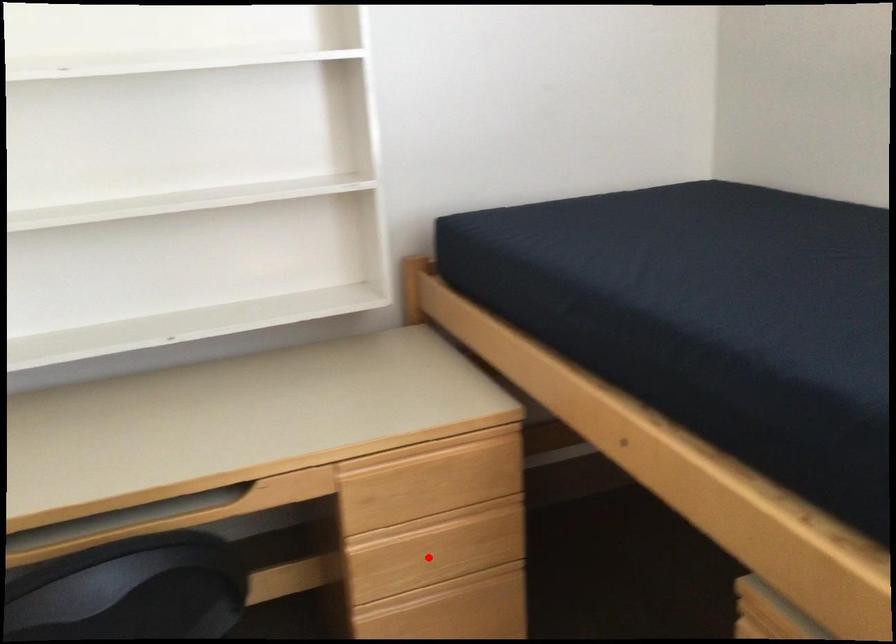
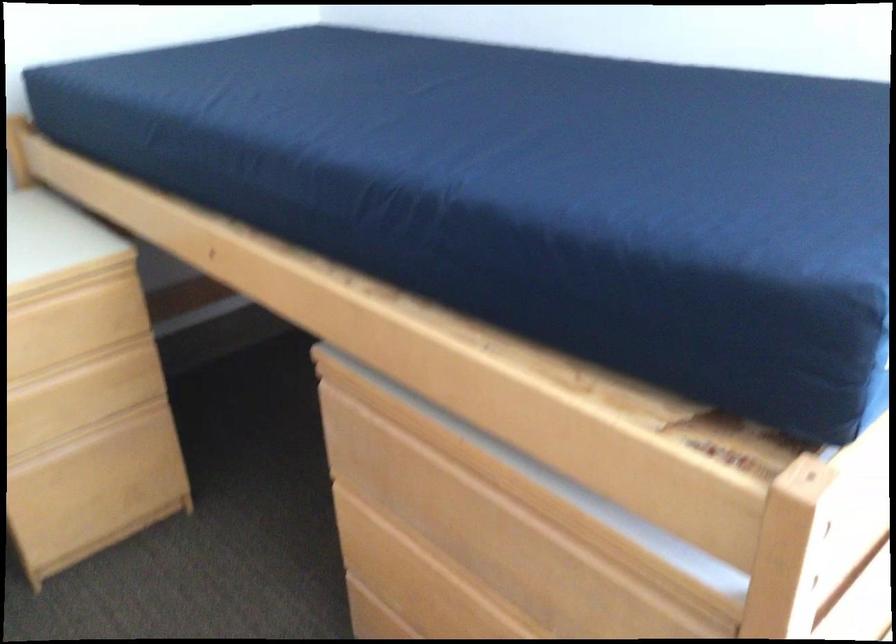
The point at the highlighted location is marked in the first image. Where is the corresponding point in the second image?

(65, 410)